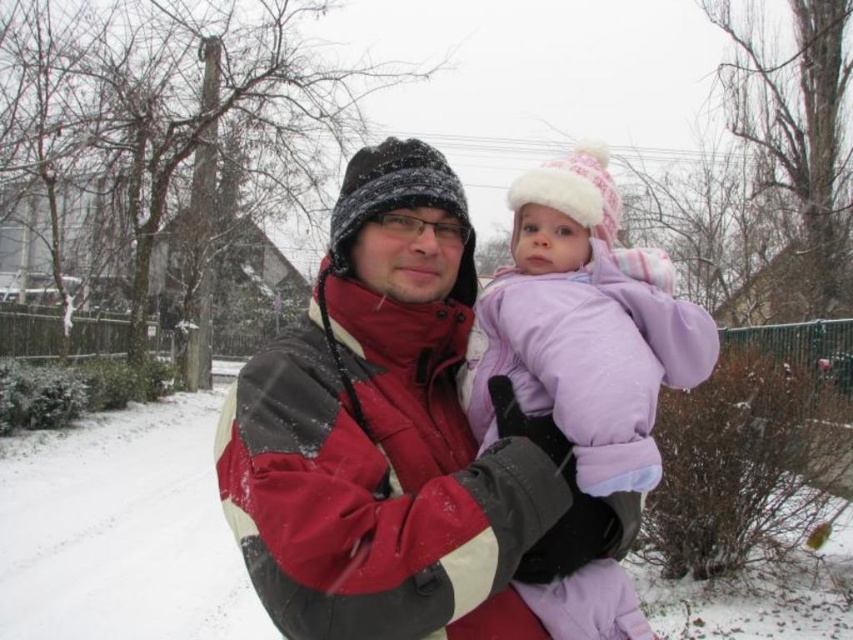
You are standing at the origin point of the image. You see two points marked as point 1 at coordinates (381, 435) and point 2 at coordinates (636, 438). Which point is closer to you?

Point 2 at coordinates (636, 438) is closer to you because it is in front of point 1 at coordinates (381, 435).

You are standing at the origin point in the image. Which direction should you move to reach the matte red jacket at center?

The matte red jacket at center is located at coordinates 0.684 on the x axis and 0.458 on the y axis. Since you are at the origin, you should move towards the right and slightly forward to reach it.